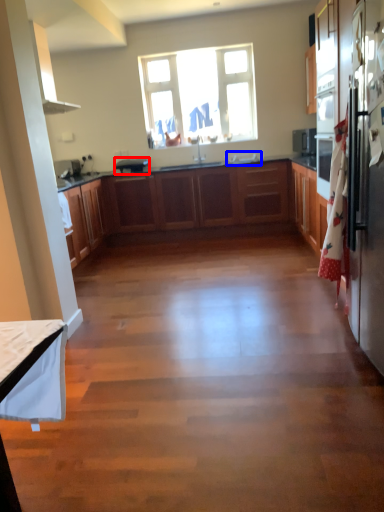
Question: Among these objects, which one is farthest to the camera, appliance (highlighted by a red box) or sink (highlighted by a blue box)?

Choices:
 (A) appliance
 (B) sink

Answer: (A)